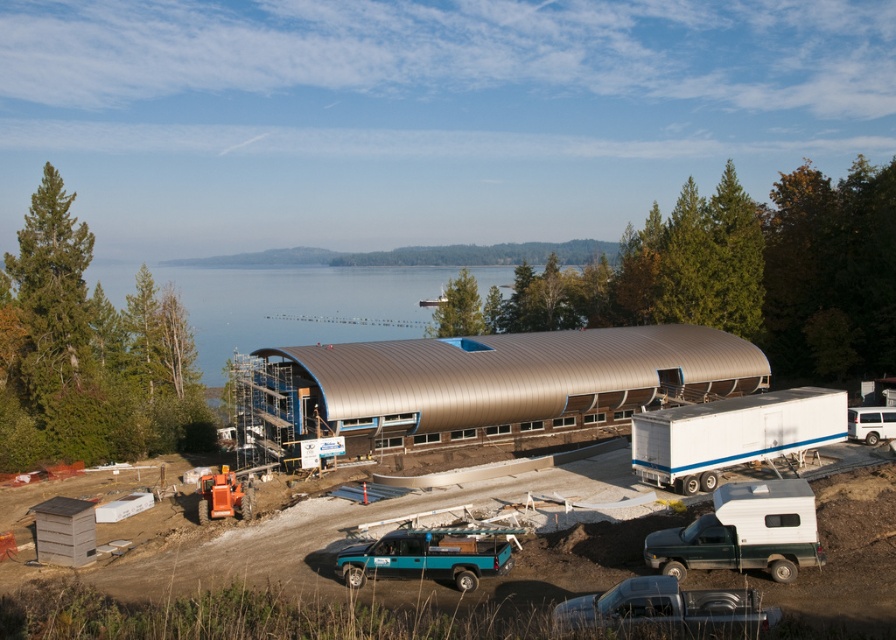
Question: Which is farther from the teal matte truck at lower center?

Choices:
 (A) metallic silver building at center
 (B) green matte truck at lower right

Answer: (B)

Question: Which object appears closest to the camera in this image?

Choices:
 (A) metallic blue truck at lower center
 (B) metallic water at center
 (C) teal matte truck at lower center

Answer: (A)

Question: Is metallic silver building at center closer to camera compared to metallic blue truck at lower center?

Choices:
 (A) yes
 (B) no

Answer: (A)

Question: Based on their relative distances, which object is nearer to the green matte truck at lower right?

Choices:
 (A) metallic water at center
 (B) metallic blue truck at lower center
 (C) teal matte truck at lower center

Answer: (B)

Question: Can you confirm if metallic water at center is positioned below teal matte truck at lower center?

Choices:
 (A) yes
 (B) no

Answer: (B)

Question: Can you confirm if metallic water at center is bigger than teal matte truck at lower center?

Choices:
 (A) no
 (B) yes

Answer: (B)